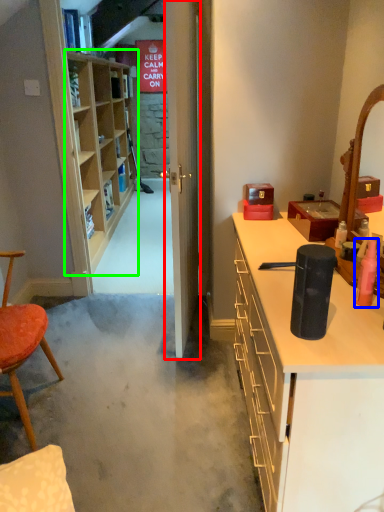
Question: Which object is the farthest from door (highlighted by a red box)? Choose among these: toiletry (highlighted by a blue box) or shelf (highlighted by a green box).

Choices:
 (A) toiletry
 (B) shelf

Answer: (B)